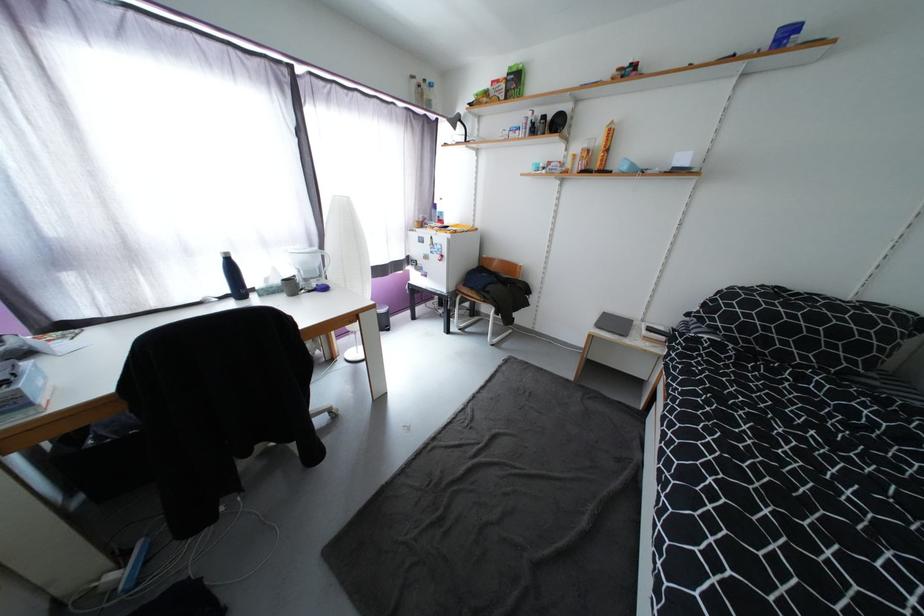
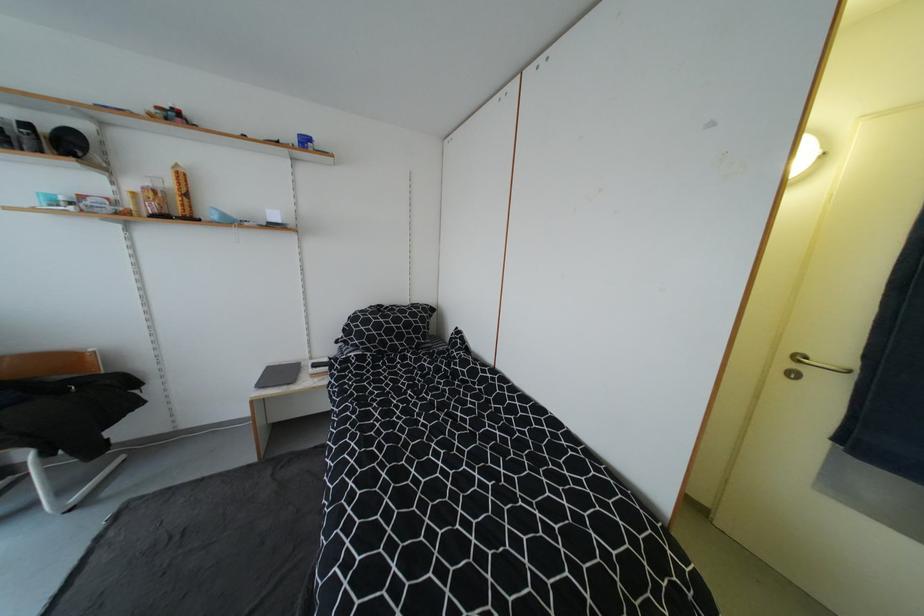
Question: How did the camera likely rotate?

Choices:
 (A) Left
 (B) Right
 (C) Up
 (D) Down

Answer: (B)